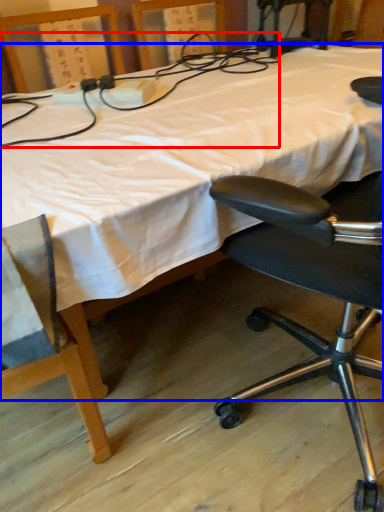
Question: Which of the following is the farthest to the observer, twin (highlighted by a red box) or bed (highlighted by a blue box)?

Choices:
 (A) twin
 (B) bed

Answer: (A)